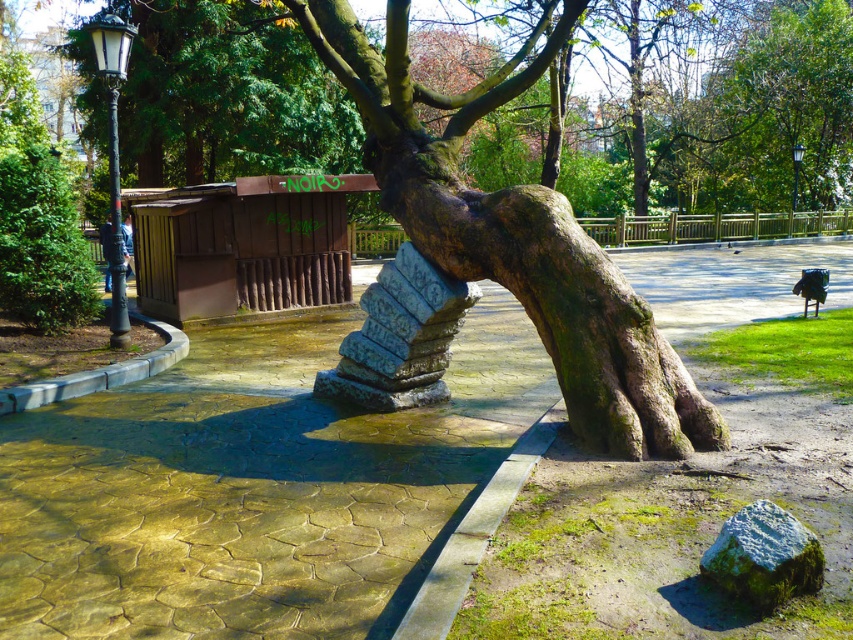
Question: Which of the following is the closest to the observer?

Choices:
 (A) (630, 436)
 (B) (468, 300)
 (C) (793, 554)

Answer: (C)

Question: Where is stone textured column at center located in relation to green mossy rock at lower right in the image?

Choices:
 (A) below
 (B) above

Answer: (B)

Question: Does green mossy bark tree trunk at center have a greater width compared to stone textured column at center?

Choices:
 (A) yes
 (B) no

Answer: (A)

Question: Which object is the closest to the green mossy bark tree trunk at center?

Choices:
 (A) stone textured column at center
 (B) green mossy rock at lower right

Answer: (A)

Question: Can you confirm if stone textured column at center is positioned to the right of green mossy rock at lower right?

Choices:
 (A) no
 (B) yes

Answer: (A)

Question: Estimate the real-world distances between objects in this image. Which object is farther from the stone textured column at center?

Choices:
 (A) green mossy bark tree trunk at center
 (B) green mossy rock at lower right

Answer: (B)